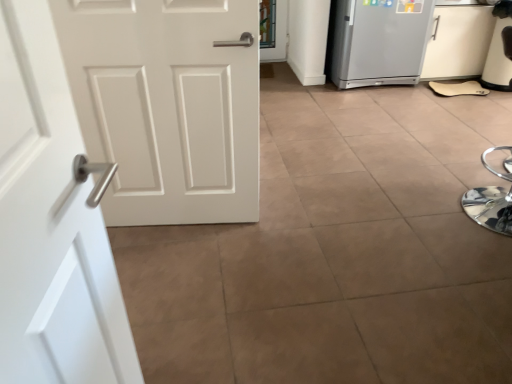
Question: In the image, is white matte door at left positioned in front of or behind silver metallic refrigerator at upper right?

Choices:
 (A) front
 (B) behind

Answer: (A)

Question: Considering the positions of white matte door at left and silver metallic refrigerator at upper right in the image, is white matte door at left taller or shorter than silver metallic refrigerator at upper right?

Choices:
 (A) tall
 (B) short

Answer: (A)

Question: From the image's perspective, is white matte door at left located above or below silver metallic refrigerator at upper right?

Choices:
 (A) below
 (B) above

Answer: (A)

Question: In the image, is silver metallic refrigerator at upper right positioned in front of or behind white matte door at left?

Choices:
 (A) behind
 (B) front

Answer: (A)

Question: From a real-world perspective, is silver metallic refrigerator at upper right physically located above or below white matte door at left?

Choices:
 (A) above
 (B) below

Answer: (B)

Question: Considering the positions of silver metallic refrigerator at upper right and white matte door at left in the image, is silver metallic refrigerator at upper right bigger or smaller than white matte door at left?

Choices:
 (A) big
 (B) small

Answer: (A)

Question: Does point (391, 33) appear closer or farther from the camera than point (53, 215)?

Choices:
 (A) farther
 (B) closer

Answer: (A)